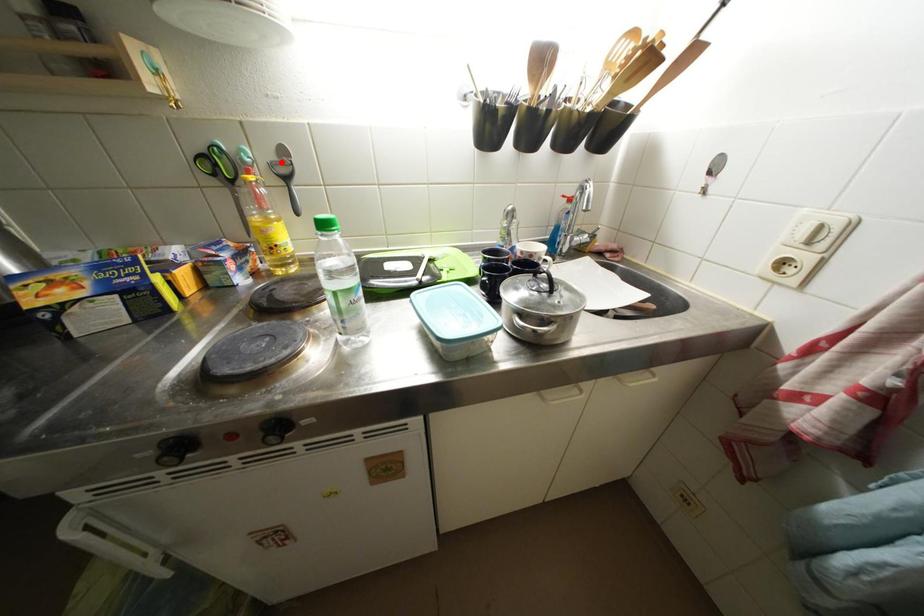
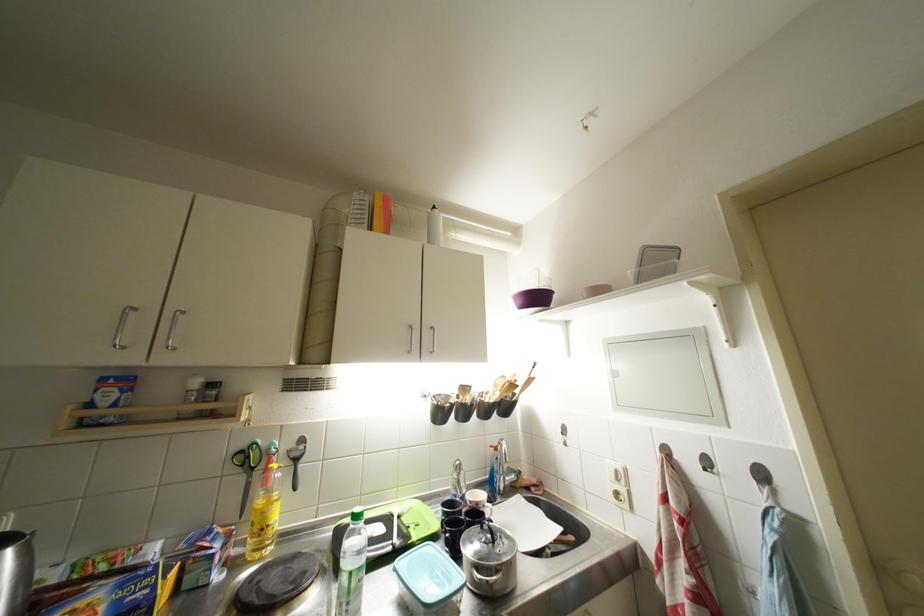
Question: I am providing you with two images of the same scene from different viewpoints. Image1 has a red point marked. In image2, the corresponding 3D location appears at what relative position? Reply with the corresponding letter.

Choices:
 (A) Closer
 (B) Farther

Answer: (B)